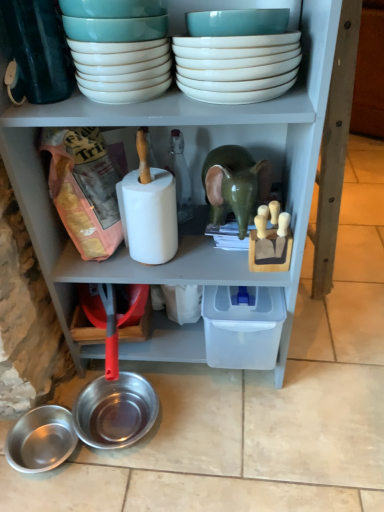
Question: In the image, is white glossy bowls at upper center, the 2th bowl viewed from the top, positioned in front of or behind shiny metallic bowl at lower left, the fourth bowl viewed from the top?

Choices:
 (A) front
 (B) behind

Answer: (A)

Question: Is point (125, 57) closer or farther from the camera than point (34, 463)?

Choices:
 (A) closer
 (B) farther

Answer: (A)

Question: Considering the real-world distances, which object is farthest from the white glossy bowls at upper center, which ranks as the 4th bowl in bottom-to-top order?

Choices:
 (A) white glossy bowls at upper center, the 2th bowl viewed from the top
 (B) shiny metallic bowl at lower left, which ranks as the second bowl in bottom-to-top order
 (C) shiny metallic bowl at lower left, arranged as the first bowl when ordered from the bottom

Answer: (C)

Question: Which is farther from the shiny metallic bowl at lower left, arranged as the first bowl when ordered from the bottom?

Choices:
 (A) white glossy bowls at upper center, the 2th bowl viewed from the top
 (B) white glossy bowls at upper center, which ranks as the 4th bowl in bottom-to-top order
 (C) shiny metallic bowl at lower left, acting as the third bowl starting from the top

Answer: (B)